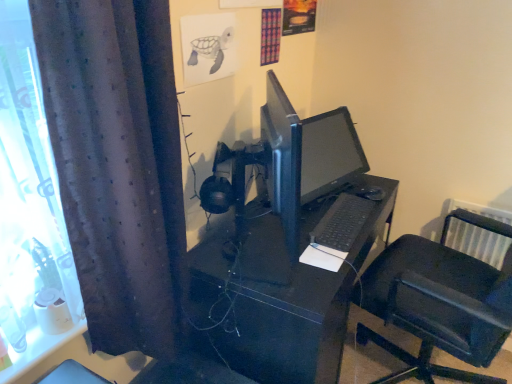
Question: Is point (360, 195) positioned closer to the camera than point (266, 137)?

Choices:
 (A) closer
 (B) farther

Answer: (B)

Question: From a real-world perspective, is black matte desk at center above or below black glossy monitor at center?

Choices:
 (A) below
 (B) above

Answer: (A)

Question: Considering the real-world distances, which object is closest to the black matte keyboard at center?

Choices:
 (A) dark purple fabric curtain at left
 (B) black plastic chair at right
 (C) black matte desk at center
 (D) black glossy monitor at center

Answer: (C)

Question: Which of these objects is positioned closest to the black plastic chair at right?

Choices:
 (A) black matte keyboard at center
 (B) black glossy monitor at center
 (C) black matte desk at center
 (D) dark purple fabric curtain at left

Answer: (A)